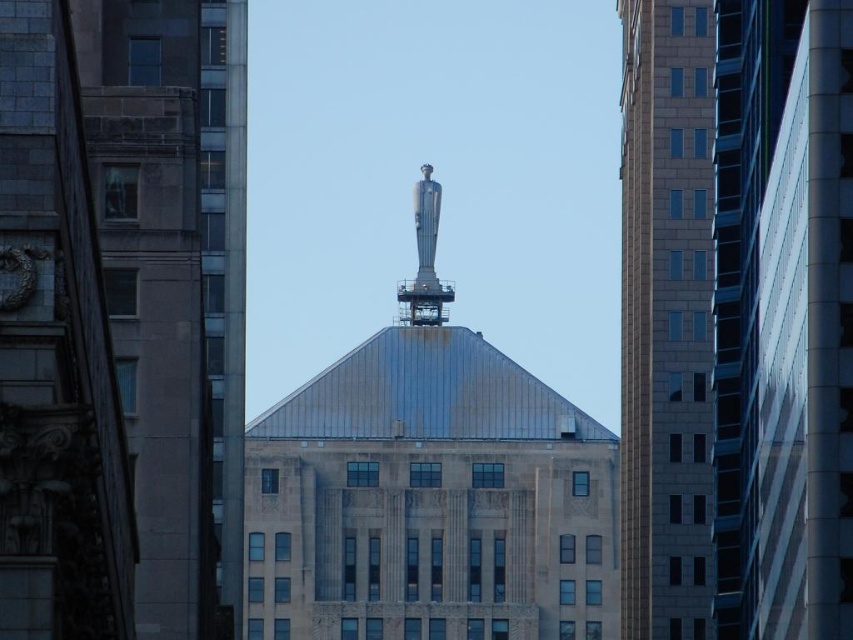
Question: Which object is the closest to the gray stone tower at left?

Choices:
 (A) silver metallic statue at center
 (B) smooth glass skyscraper at center

Answer: (B)

Question: Is slate gray concrete building at right positioned before silver metallic spire at center?

Choices:
 (A) no
 (B) yes

Answer: (B)

Question: Among these points, which one is nearest to the camera?

Choices:
 (A) (625, 353)
 (B) (410, 460)
 (C) (178, 29)

Answer: (C)

Question: Which of the following is the farthest from the observer?

Choices:
 (A) coord(149,230)
 (B) coord(297,570)

Answer: (B)

Question: Is silver metallic statue at center above silver metallic spire at center?

Choices:
 (A) yes
 (B) no

Answer: (B)

Question: Does gray stone tower at left have a larger size compared to silver metallic spire at center?

Choices:
 (A) yes
 (B) no

Answer: (A)